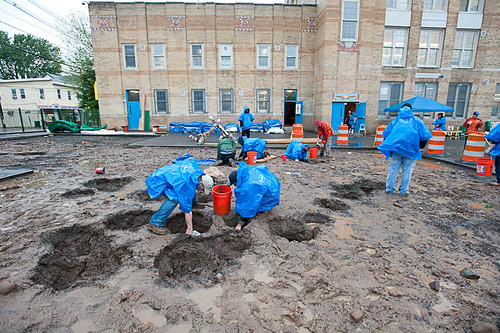
The height and width of the screenshot is (333, 500). Find the location of `upper floor windows`. upper floor windows is located at coordinates (131, 57), (162, 54), (199, 56), (230, 54), (260, 57), (290, 58), (352, 23), (397, 43), (428, 58), (466, 48).